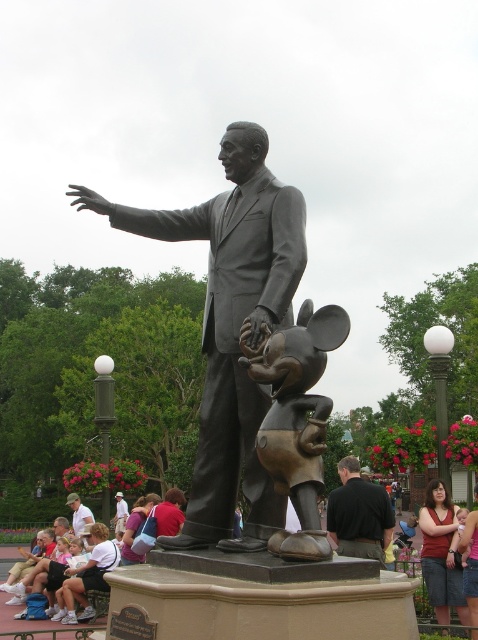
You are an artist planning to sketch the statue and its pedestal. You notice the bronze mickey mouse at center and the white shirt at lower left. Which object is narrower in width when viewed from your perspective?

The bronze mickey mouse at center has a lesser width compared to the white shirt at lower left, so it is narrower.

You are standing at the entrance of the park and want to take a photo of the bronze statue at center. If your camera has a maximum focus range of 30 feet, will you be able to capture the statue clearly?

The bronze statue at center is 35.94 feet away from the camera. Since the camera can only focus up to 30 feet, you won not be able to capture the statue clearly.

You are an artist planning to sketch the scene. You need to decide the size of your drawing paper. Based on the sizes of the bronze mickey mouse at center and the white shirt at lower left, which object should you allocate more space for on the paper?

The bronze mickey mouse at center is smaller than the white shirt at lower left, so you should allocate more space for the white shirt at lower left on the paper since it is larger.